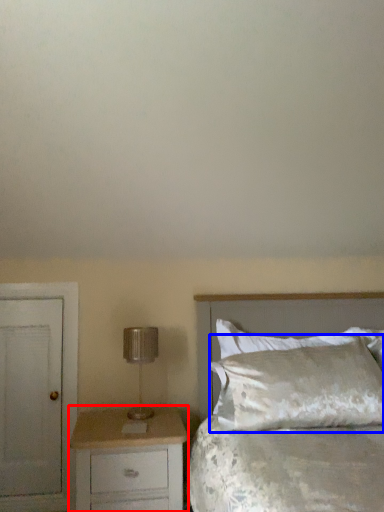
Question: Which of the following is the closest to the observer, chest of drawers (highlighted by a red box) or pillow (highlighted by a blue box)?

Choices:
 (A) chest of drawers
 (B) pillow

Answer: (A)